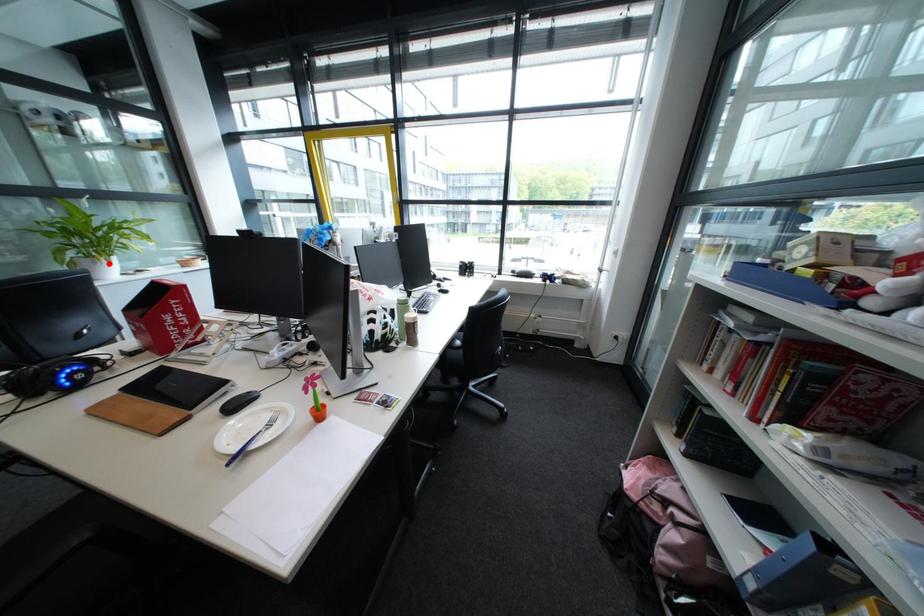
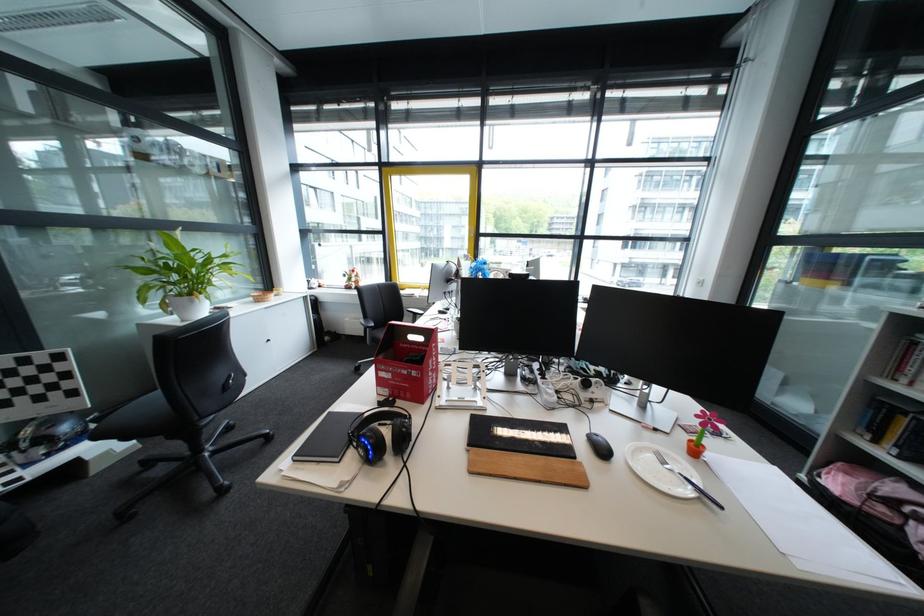
Where in the second image is the point corresponding to the highlighted location from the first image?

(207, 302)